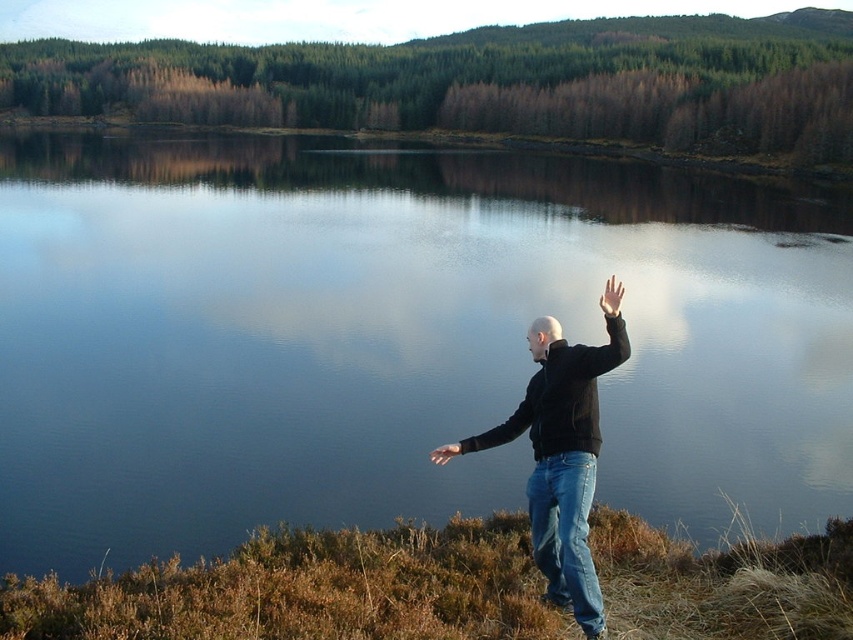
You are a photographer planning to take a wide shot of the scene. You need to ensure both the blue reflective water at center and the black matte jacket at center are clearly visible. Given their sizes, which one might require more careful framing to avoid being too small in the photo?

The black matte jacket at center is smaller than the blue reflective water at center, so it might require more careful framing to avoid being too small in the photo.

You are a photographer trying to capture the person in the scene. Since the black matte arm at right and the black matte jacket at center are both dark, could the arm be partially hidden by the jacket in the photo?

Yes, the black matte arm at right is behind the black matte jacket at center, so it might be partially hidden in the photo.

You are a photographer trying to capture the person in the scene. The person has two hands visible in the image. Which hand, the light brown leather hand at center right or the matte black hand at lower right, is positioned closer to the camera?

The light brown leather hand at center right is closer to the viewer than the matte black hand at lower right, so it is positioned closer to the camera.